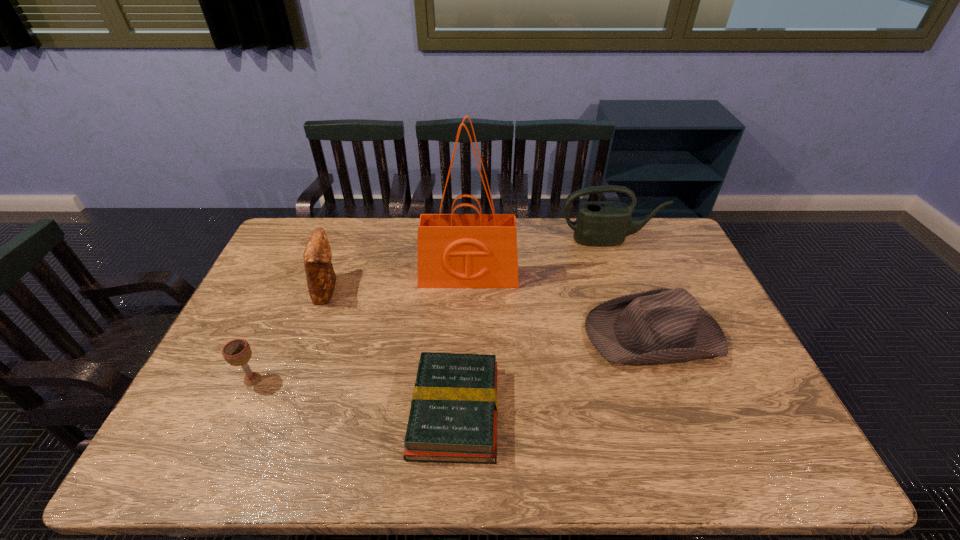
You are a GUI agent. You are given a task and a screenshot of the screen. Output one action in this format:
    pyautogui.click(x=<x>, y=<y>)
    Task: Click on the free space located 0.140m on the back of the fedora
    
    Given the screenshot: What is the action you would take?
    pyautogui.click(x=629, y=271)

This screenshot has height=540, width=960. I want to click on vacant space positioned on the right of the chalice, so click(x=337, y=380).

The height and width of the screenshot is (540, 960). What are the coordinates of `vacant space located on the back of the hardback book` in the screenshot? It's located at (457, 352).

Where is `object at the far edge`? object at the far edge is located at coordinates (602, 223).

The width and height of the screenshot is (960, 540). In order to click on object that is at the near edge in this screenshot , I will do `click(453, 418)`.

This screenshot has height=540, width=960. What are the coordinates of `object at the left edge` in the screenshot? It's located at (237, 352).

You are a GUI agent. You are given a task and a screenshot of the screen. Output one action in this format:
    pyautogui.click(x=<x>, y=<y>)
    Task: Click on the watering can that is at the right edge
    This screenshot has width=960, height=540.
    Given the screenshot: What is the action you would take?
    pyautogui.click(x=602, y=223)

Locate an element on the screen. The width and height of the screenshot is (960, 540). fedora that is at the right edge is located at coordinates (661, 325).

Where is `object located in the far right corner section of the desktop`? The width and height of the screenshot is (960, 540). object located in the far right corner section of the desktop is located at coordinates (602, 223).

In the image, there is a desktop. In order to click on vacant region at the far edge in this screenshot , I will do `click(592, 253)`.